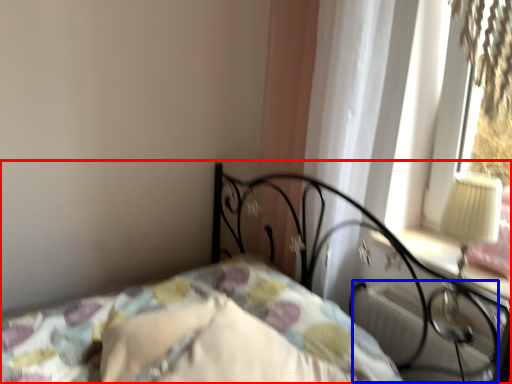
Question: Which object is closer to the camera taking this photo, bed (highlighted by a red box) or radiator (highlighted by a blue box)?

Choices:
 (A) bed
 (B) radiator

Answer: (A)